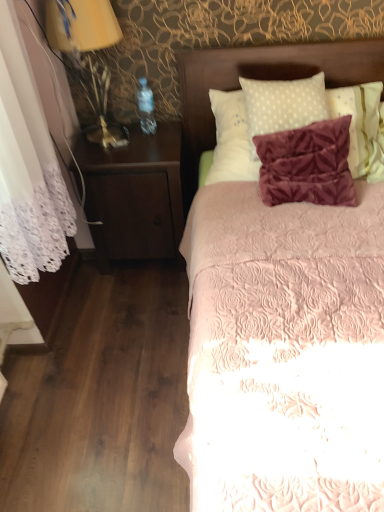
Find the location of a particular element. The width and height of the screenshot is (384, 512). free point below matte gold lamp at left (from a real-world perspective) is located at coordinates (104, 135).